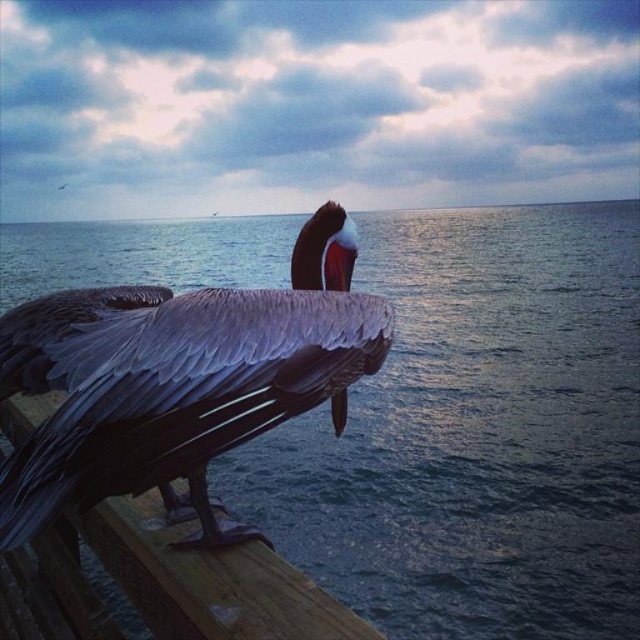
Question: Can you confirm if gray feathered pelican at center is smaller than wooden at left?

Choices:
 (A) no
 (B) yes

Answer: (A)

Question: Is gray feathered pelican at center below wooden at left?

Choices:
 (A) yes
 (B) no

Answer: (B)

Question: Does gray feathered pelican at center have a lesser width compared to wooden at left?

Choices:
 (A) yes
 (B) no

Answer: (B)